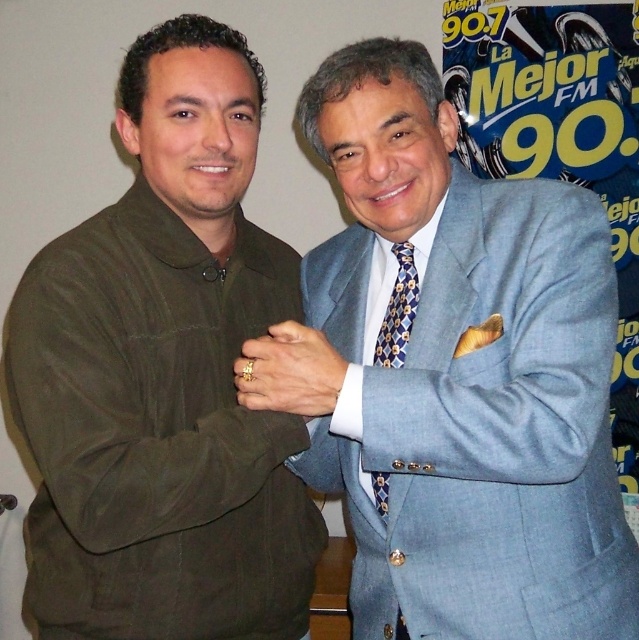
Question: Which point is farther to the camera?

Choices:
 (A) matte gray suit at center
 (B) blue patterned tie at center

Answer: (B)

Question: Can you confirm if matte gray suit at center is wider than matte olive-green jacket at left?

Choices:
 (A) yes
 (B) no

Answer: (A)

Question: Does matte olive-green jacket at left have a smaller size compared to blue patterned tie at center?

Choices:
 (A) no
 (B) yes

Answer: (A)

Question: Which object is the closest to the matte olive-green jacket at left?

Choices:
 (A) matte gray suit at center
 (B) blue patterned tie at center

Answer: (A)

Question: Is matte gray suit at center further to camera compared to blue patterned tie at center?

Choices:
 (A) no
 (B) yes

Answer: (A)

Question: Which point is closer to the camera taking this photo?

Choices:
 (A) (144, 540)
 (B) (406, 316)
 (C) (532, 273)

Answer: (C)